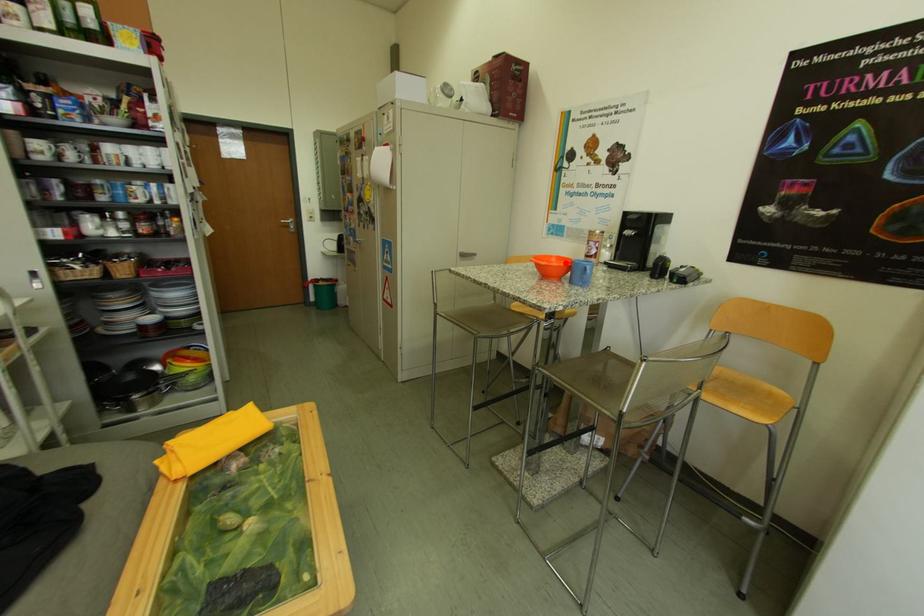
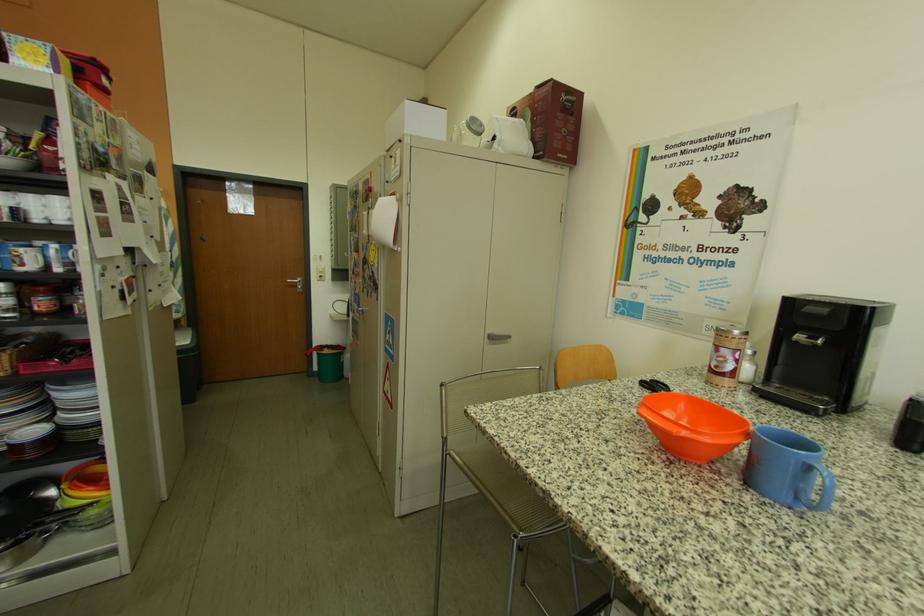
Find the pixel in the second image that matches the highlighted location in the first image.

(695, 408)